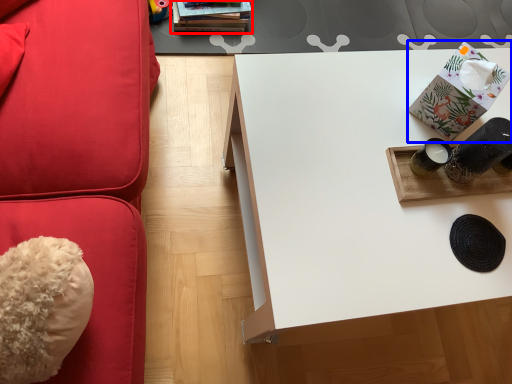
Question: Which point is further to the camera, book (highlighted by a red box) or package (highlighted by a blue box)?

Choices:
 (A) book
 (B) package

Answer: (A)